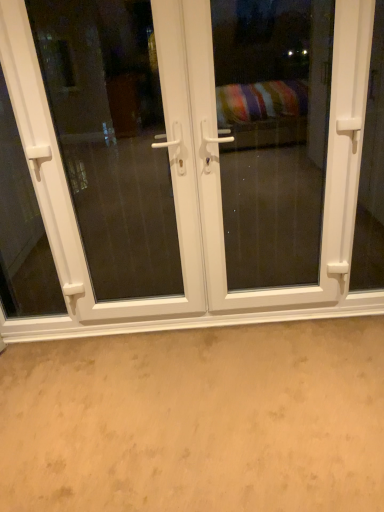
Question: Considering the positions of white plastic screen door at center, acting as the first screen door starting from the left, and white plastic handle at left in the image, is white plastic screen door at center, acting as the first screen door starting from the left, wider or thinner than white plastic handle at left?

Choices:
 (A) thin
 (B) wide

Answer: (B)

Question: Considering the relative positions of white plastic screen door at center, acting as the first screen door starting from the left, and white plastic handle at left in the image provided, is white plastic screen door at center, acting as the first screen door starting from the left, to the left or to the right of white plastic handle at left?

Choices:
 (A) right
 (B) left

Answer: (A)

Question: Which of these objects is positioned farthest from the white plastic screen door at center, acting as the first screen door starting from the left?

Choices:
 (A) white plastic handle at left
 (B) beige carpet at lower center
 (C) white plastic door at center
 (D) white plastic screen door at center, which appears as the first screen door when viewed from the right

Answer: (B)

Question: Which object is the closest to the white plastic door at center?

Choices:
 (A) white plastic screen door at center, positioned as the 2th screen door in right-to-left order
 (B) beige carpet at lower center
 (C) white plastic handle at left
 (D) white plastic screen door at center, which appears as the first screen door when viewed from the right

Answer: (B)